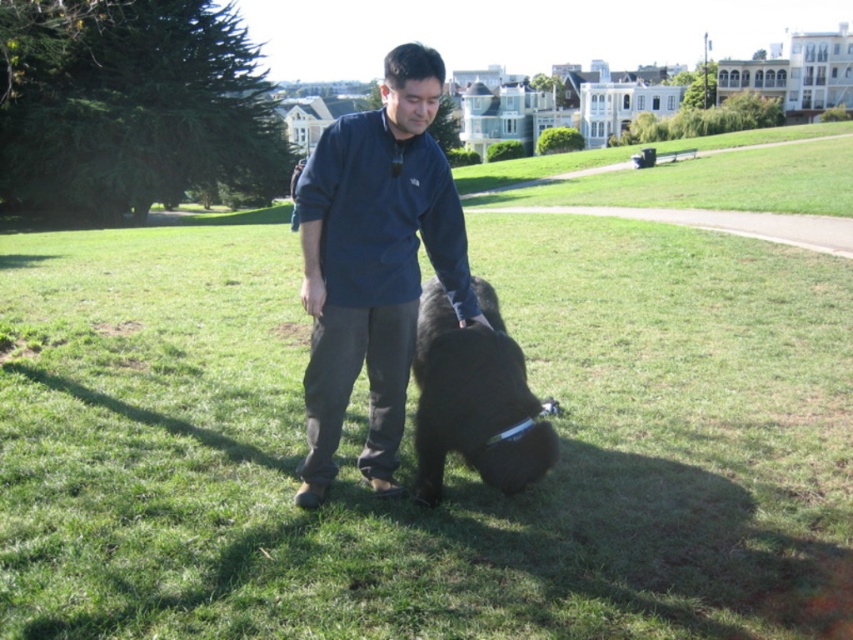
Looking at this image, who is more forward, (393,262) or (432,428)?

Positioned in front is point (393,262).

Who is shorter, dark blue fleece at center or black fur dog at center?

black fur dog at center is shorter.

You are a GUI agent. You are given a task and a screenshot of the screen. Output one action in this format:
    pyautogui.click(x=<x>, y=<y>)
    Task: Click on the dark blue fleece at center
    This screenshot has height=640, width=853.
    Given the screenshot: What is the action you would take?
    pyautogui.click(x=374, y=262)